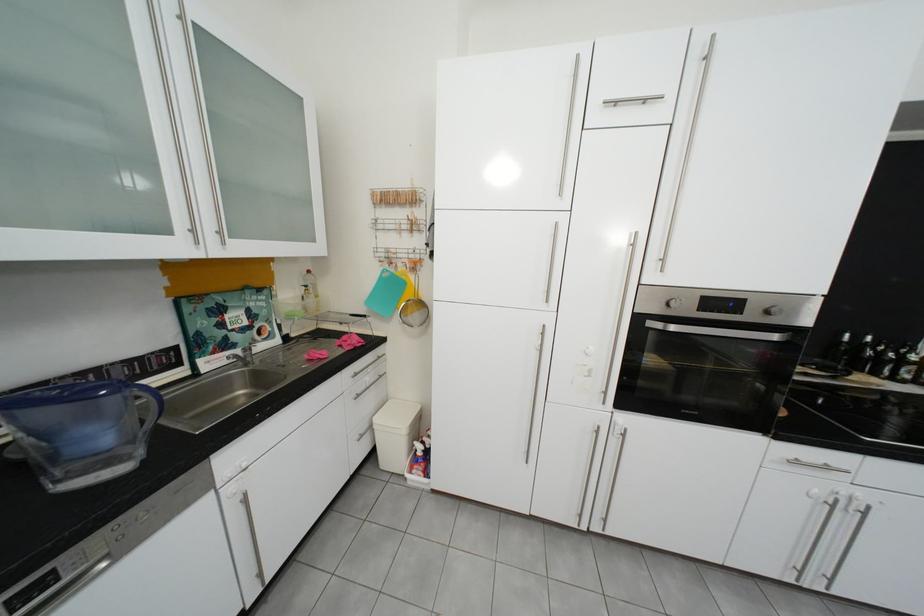
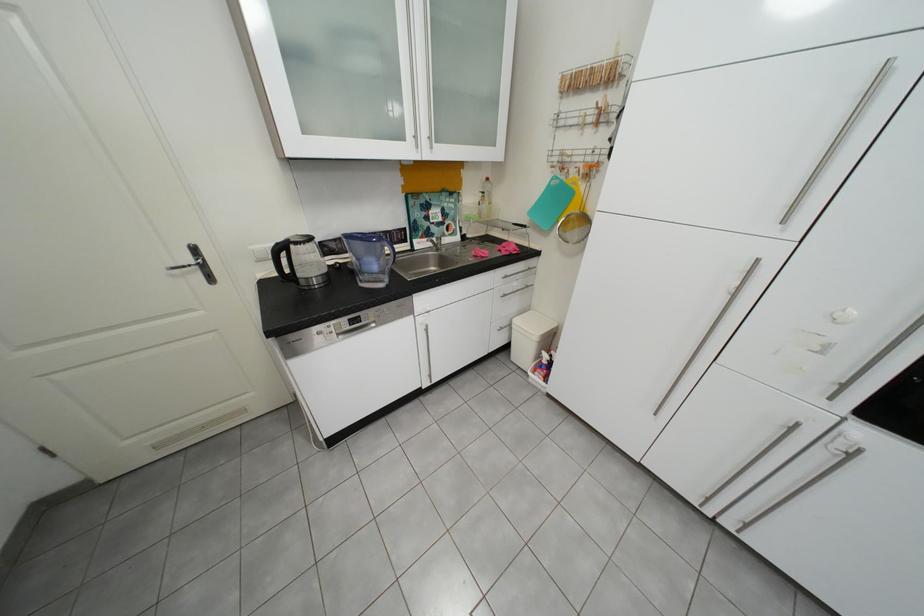
The first image is from the beginning of the video and the second image is from the end. How did the camera likely rotate when shooting the video?

The camera's rotation is toward left-down.